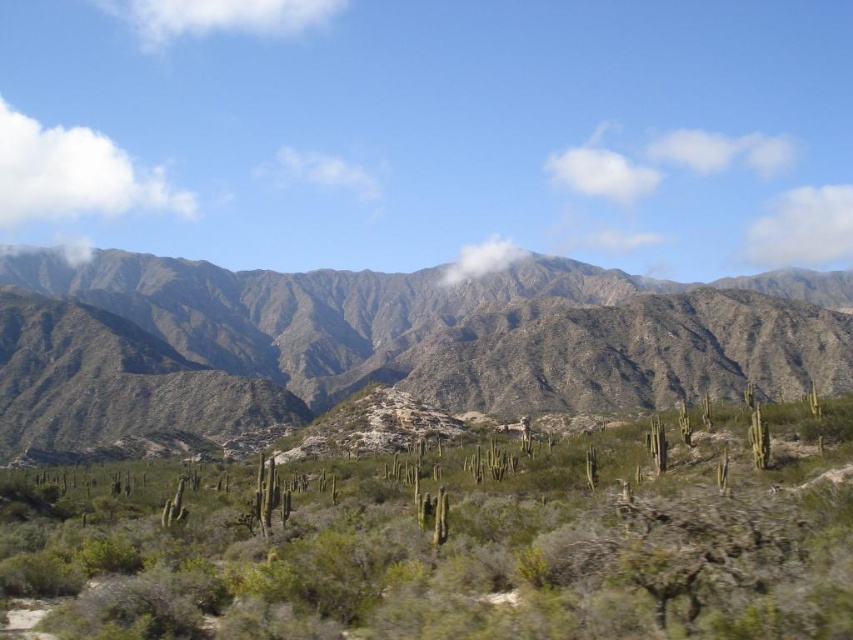
You are standing in the desert and see the green spiky cactus at center. If you want to take a photo of it with your camera, which has a maximum zoom range of 25 meters, will you be able to capture the cactus clearly without moving closer?

The green spiky cactus at center is 27.50 meters away from the viewer. Since the camera can only zoom up to 25 meters, you won cannot capture it clearly without moving closer.